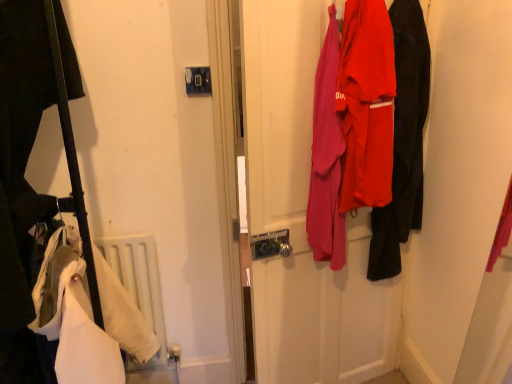
Question: From a real-world perspective, is matte black jacket at right positioned over white matte radiator at lower left based on gravity?

Choices:
 (A) yes
 (B) no

Answer: (A)

Question: Does matte black jacket at right have a greater width compared to white matte radiator at lower left?

Choices:
 (A) yes
 (B) no

Answer: (A)

Question: Is matte black jacket at right smaller than white matte radiator at lower left?

Choices:
 (A) no
 (B) yes

Answer: (A)

Question: Does matte black jacket at right come behind white matte radiator at lower left?

Choices:
 (A) yes
 (B) no

Answer: (B)

Question: From the image's perspective, is matte black jacket at right located above white matte radiator at lower left?

Choices:
 (A) yes
 (B) no

Answer: (A)

Question: Is white matte radiator at lower left inside or outside of matte black jacket at right?

Choices:
 (A) inside
 (B) outside

Answer: (B)

Question: Considering the positions of white matte radiator at lower left and matte black jacket at right in the image, is white matte radiator at lower left taller or shorter than matte black jacket at right?

Choices:
 (A) short
 (B) tall

Answer: (A)

Question: Is point (158, 317) closer or farther from the camera than point (373, 238)?

Choices:
 (A) closer
 (B) farther

Answer: (B)

Question: In terms of width, does white matte radiator at lower left look wider or thinner when compared to matte black jacket at right?

Choices:
 (A) thin
 (B) wide

Answer: (A)

Question: Is matte fabric coats at center to the left or to the right of white matte radiator at lower left in the image?

Choices:
 (A) right
 (B) left

Answer: (A)

Question: From the image's perspective, is matte fabric coats at center positioned above or below white matte radiator at lower left?

Choices:
 (A) above
 (B) below

Answer: (A)

Question: In terms of size, does matte fabric coats at center appear bigger or smaller than white matte radiator at lower left?

Choices:
 (A) small
 (B) big

Answer: (B)

Question: Is matte fabric coats at center taller or shorter than white matte radiator at lower left?

Choices:
 (A) short
 (B) tall

Answer: (B)

Question: In terms of height, does white matte radiator at lower left look taller or shorter compared to matte fabric coats at center?

Choices:
 (A) short
 (B) tall

Answer: (A)

Question: Is white matte radiator at lower left wider or thinner than matte fabric coats at center?

Choices:
 (A) thin
 (B) wide

Answer: (A)